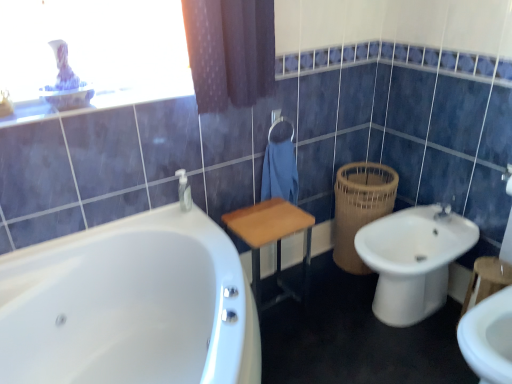
At what (x,y) coordinates should I click in order to perform the action: click on free spot to the left of white ceramic bidet at lower right. Please return your answer as a coordinate pair (x, y). The image size is (512, 384). Looking at the image, I should click on (324, 310).